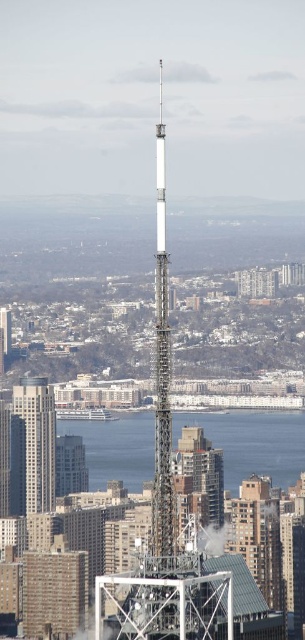
Question: Among these points, which one is nearest to the camera?

Choices:
 (A) (40, 406)
 (B) (99, 484)

Answer: (A)

Question: Can you confirm if clear water at center is positioned to the right of matte glass skyscraper at center?

Choices:
 (A) yes
 (B) no

Answer: (A)

Question: Which point is farther to the camera?

Choices:
 (A) (50, 394)
 (B) (107, 442)

Answer: (B)

Question: Is clear water at center positioned behind matte glass skyscraper at center?

Choices:
 (A) no
 (B) yes

Answer: (A)

Question: Among these points, which one is farthest from the camera?

Choices:
 (A) (45, 472)
 (B) (150, 470)

Answer: (A)

Question: Is clear water at center positioned before matte glass skyscraper at center?

Choices:
 (A) no
 (B) yes

Answer: (B)